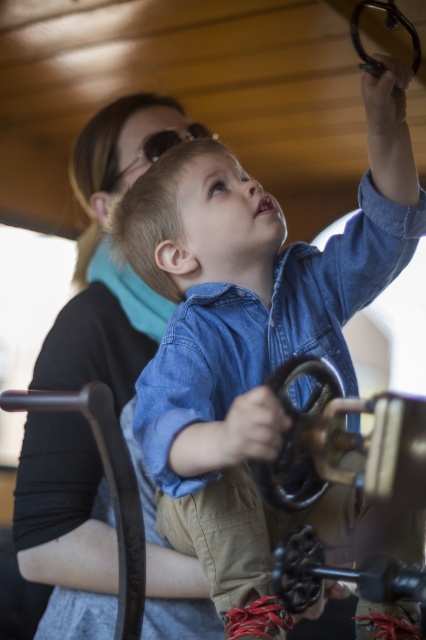
Is denim shirt at upper center wider than black matte shirt at upper left?

Indeed, denim shirt at upper center has a greater width compared to black matte shirt at upper left.

Is denim shirt at upper center positioned at the back of black matte shirt at upper left?

No, it is not.

The image size is (426, 640). In order to click on denim shirt at upper center in this screenshot , I will do `click(249, 323)`.

At what (x,y) coordinates should I click in order to perform the action: click on denim shirt at upper center. Please return your answer as a coordinate pair (x, y). Looking at the image, I should click on (249, 323).

Is black matte shirt at upper left positioned at the back of matte black goggles at upper center?

No, it is in front of matte black goggles at upper center.

Image resolution: width=426 pixels, height=640 pixels. What are the coordinates of `black matte shirt at upper left` in the screenshot? It's located at (124, 330).

Is denim shirt at upper center bigger than matte black goggles at upper center?

Indeed, denim shirt at upper center has a larger size compared to matte black goggles at upper center.

Image resolution: width=426 pixels, height=640 pixels. Describe the element at coordinates (249, 323) in the screenshot. I see `denim shirt at upper center` at that location.

Locate an element on the screen. This screenshot has height=640, width=426. denim shirt at upper center is located at coordinates (249, 323).